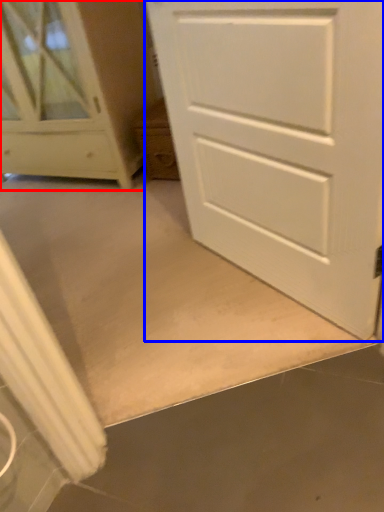
Question: Which object is further to the camera taking this photo, chest of drawers (highlighted by a red box) or door (highlighted by a blue box)?

Choices:
 (A) chest of drawers
 (B) door

Answer: (A)